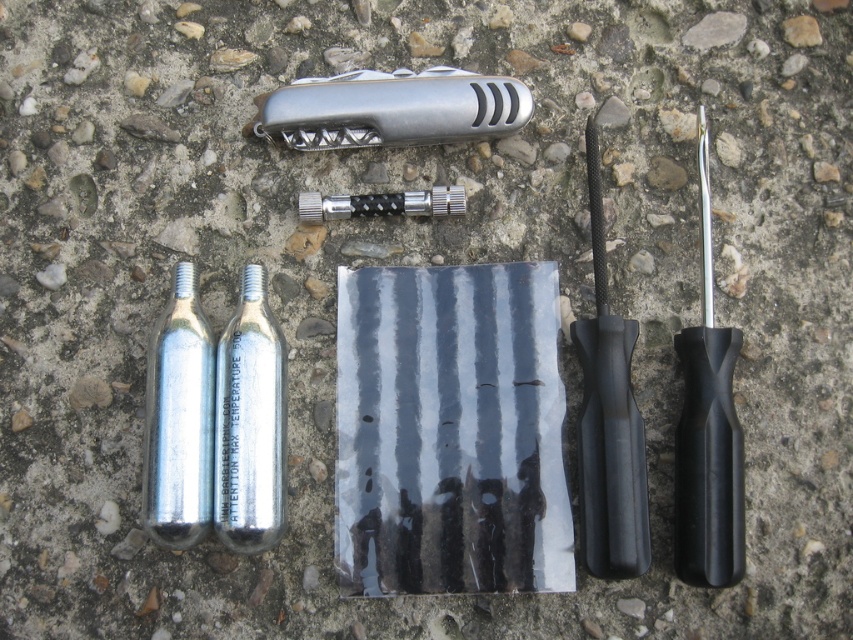
What is located at the point marked by the coordinates (393, 108)?

The point marked by the coordinates (393, 108) is located at the silver metallic pocketknife at center.

You are trying to reach the black textured razor at center but there is a silver metallic pocketknife at center in the way. Can you move the pocketknife to access the razor?

The silver metallic pocketknife at center is in front of the black textured razor at center, so you can move the pocketknife to access the razor.